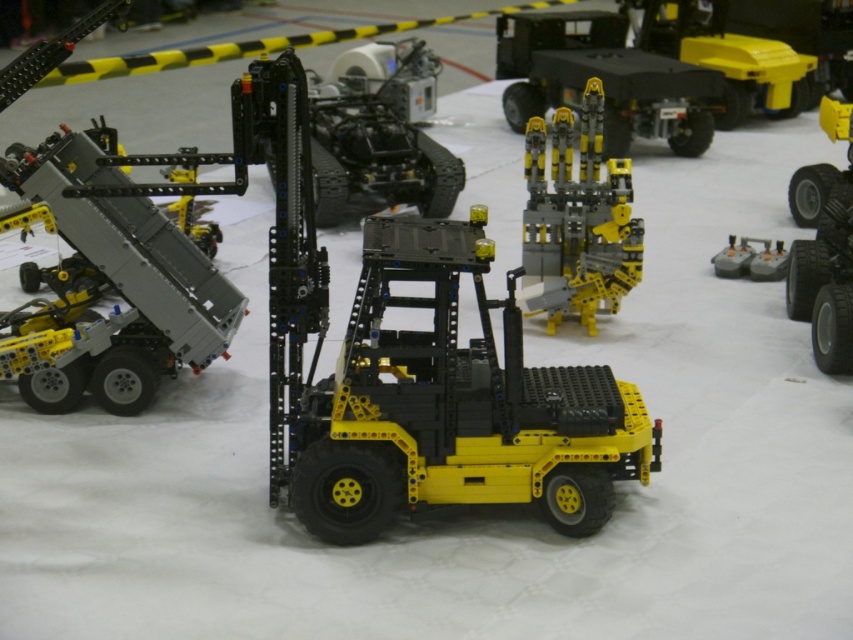
Question: Can you confirm if yellow matte/black plastic forklift at center is positioned to the right of yellow matte mechanical arm at center?

Choices:
 (A) no
 (B) yes

Answer: (A)

Question: Which point appears closest to the camera in this image?

Choices:
 (A) (163, 326)
 (B) (503, 13)
 (C) (744, 252)
 (D) (529, 312)

Answer: (A)

Question: In this image, where is matte gray truck at left located relative to yellow matte mechanical arm at center?

Choices:
 (A) right
 (B) left

Answer: (B)

Question: Estimate the real-world distances between objects in this image. Which object is closer to the yellow matte truck at right?

Choices:
 (A) matte gray truck at left
 (B) yellow plastic truck at upper right
 (C) yellow matte/black plastic forklift at center
 (D) yellow matte mechanical arm at center

Answer: (D)

Question: Can you confirm if matte gray truck at left is positioned to the right of yellow matte mechanical arm at center?

Choices:
 (A) yes
 (B) no

Answer: (B)

Question: Which object appears closest to the camera in this image?

Choices:
 (A) yellow plastic truck at upper right
 (B) matte gray tank at center

Answer: (B)